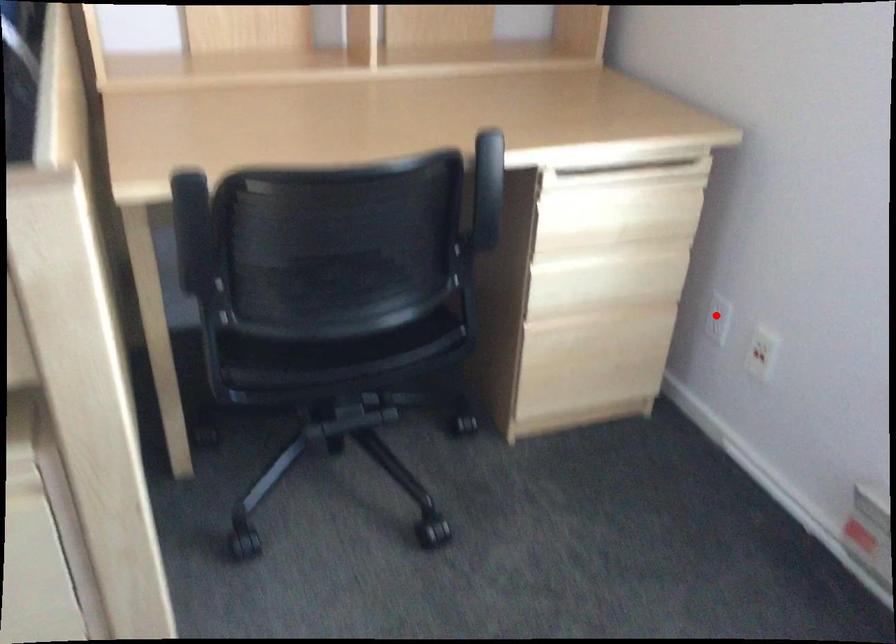
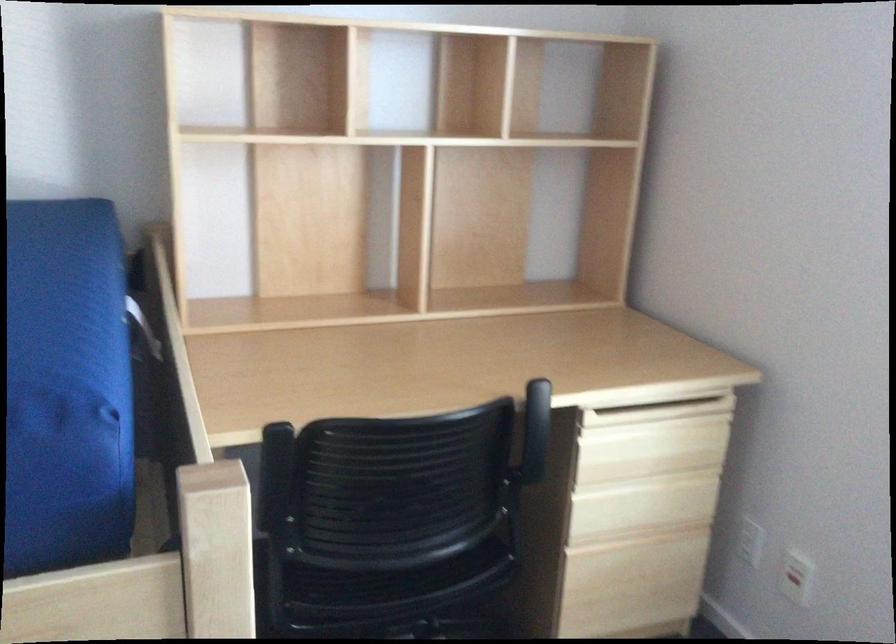
The point at the highlighted location is marked in the first image. Where is the corresponding point in the second image?

(750, 541)